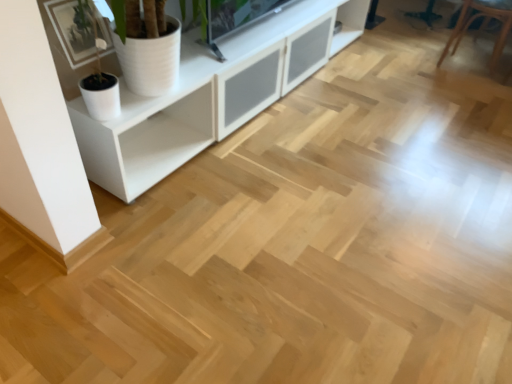
Question: From a real-world perspective, is brown leather armchair at upper right positioned over white matte cabinet at upper left based on gravity?

Choices:
 (A) yes
 (B) no

Answer: (B)

Question: Is brown leather armchair at upper right positioned beyond the bounds of white matte cabinet at upper left?

Choices:
 (A) yes
 (B) no

Answer: (A)

Question: From the image's perspective, is brown leather armchair at upper right on top of white matte cabinet at upper left?

Choices:
 (A) no
 (B) yes

Answer: (B)

Question: Considering the relative sizes of brown leather armchair at upper right and white matte cabinet at upper left in the image provided, is brown leather armchair at upper right taller than white matte cabinet at upper left?

Choices:
 (A) yes
 (B) no

Answer: (B)

Question: Is brown leather armchair at upper right further to the viewer compared to white matte cabinet at upper left?

Choices:
 (A) no
 (B) yes

Answer: (B)

Question: Is brown leather armchair at upper right to the left of white matte cabinet at upper left from the viewer's perspective?

Choices:
 (A) no
 (B) yes

Answer: (A)

Question: Is brown leather armchair at upper right aimed at white matte pot at upper left?

Choices:
 (A) yes
 (B) no

Answer: (B)

Question: From the image's perspective, does brown leather armchair at upper right appear lower than white matte pot at upper left?

Choices:
 (A) yes
 (B) no

Answer: (B)

Question: From a real-world perspective, is brown leather armchair at upper right positioned under white matte pot at upper left based on gravity?

Choices:
 (A) yes
 (B) no

Answer: (A)

Question: Considering the relative sizes of brown leather armchair at upper right and white matte pot at upper left in the image provided, is brown leather armchair at upper right smaller than white matte pot at upper left?

Choices:
 (A) yes
 (B) no

Answer: (B)

Question: Would you consider brown leather armchair at upper right to be distant from white matte pot at upper left?

Choices:
 (A) yes
 (B) no

Answer: (A)

Question: Does brown leather armchair at upper right lie in front of white matte pot at upper left?

Choices:
 (A) no
 (B) yes

Answer: (A)

Question: From a real-world perspective, is white matte pot at upper left under white matte cabinet at upper left?

Choices:
 (A) no
 (B) yes

Answer: (B)